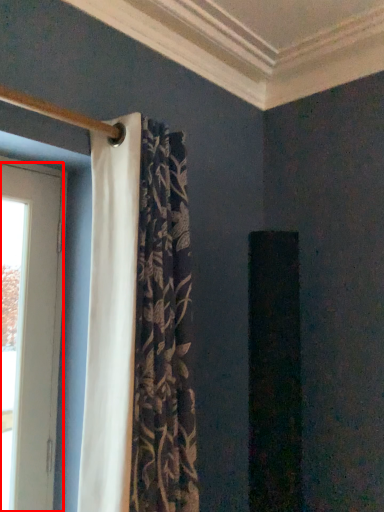
Question: Observing the image, what is the correct spatial positioning of door (annotated by the red box) in reference to curtain?

Choices:
 (A) left
 (B) right

Answer: (A)